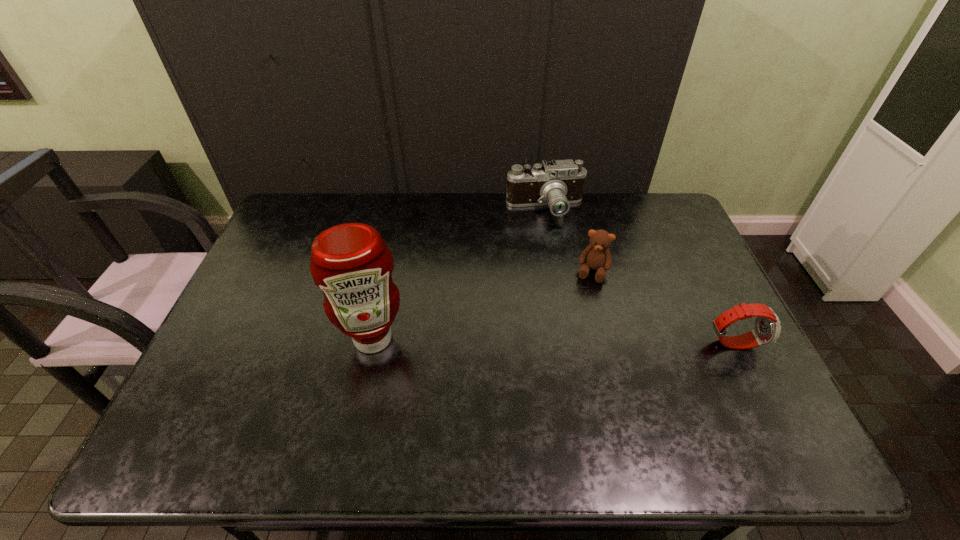
Find the location of a particular element. free space between the condiment and the camera is located at coordinates (459, 274).

Identify the location of free space between the farthest object and the teddy bear. (x=569, y=240).

This screenshot has width=960, height=540. I want to click on free space between the condiment and the teddy bear, so click(x=483, y=305).

Where is `free space between the rightmost object and the tallest object`? free space between the rightmost object and the tallest object is located at coordinates pyautogui.click(x=553, y=341).

The width and height of the screenshot is (960, 540). I want to click on free space between the third nearest object and the watch, so click(x=662, y=307).

The image size is (960, 540). In order to click on free space between the camera and the second farthest object in this screenshot , I will do click(569, 240).

Identify the location of unoccupied area between the condiment and the farthest object. (459, 274).

This screenshot has height=540, width=960. Find the location of `free space between the camera and the condiment`. free space between the camera and the condiment is located at coordinates (459, 274).

In order to click on blank region between the rightmost object and the camera in this screenshot , I will do `click(639, 275)`.

Find the location of a particular element. The width and height of the screenshot is (960, 540). vacant region between the farthest object and the watch is located at coordinates (639, 275).